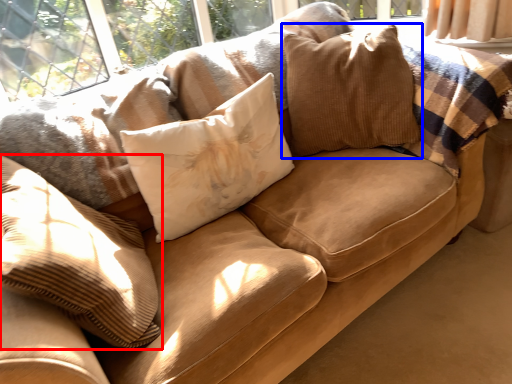
Question: Which object appears farthest to the camera in this image, pillow (highlighted by a red box) or pillow (highlighted by a blue box)?

Choices:
 (A) pillow
 (B) pillow

Answer: (B)